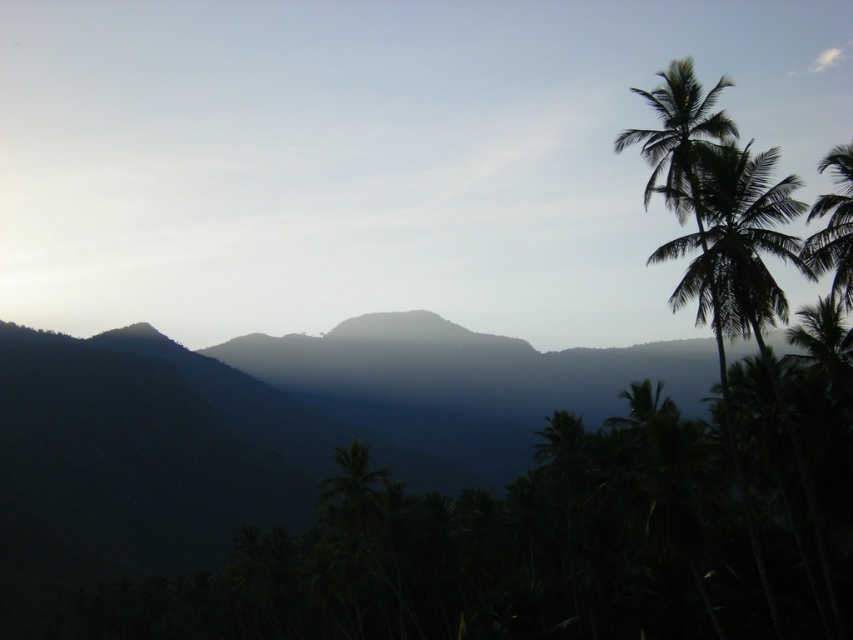
Question: Among these objects, which one is nearest to the camera?

Choices:
 (A) green leafy palm tree at upper right
 (B) green leafy palm tree at right

Answer: (B)

Question: Is green leafy palm tree at upper right to the left of green leafy palm tree at right from the viewer's perspective?

Choices:
 (A) no
 (B) yes

Answer: (B)

Question: Is green leafy palm tree at upper right positioned before green leafy palm tree at right?

Choices:
 (A) yes
 (B) no

Answer: (B)

Question: Which point is closer to the camera?

Choices:
 (A) (718, 83)
 (B) (815, 250)

Answer: (B)

Question: Which point is closer to the camera?

Choices:
 (A) green leafy palm tree at right
 (B) green leafy palm tree at upper right

Answer: (A)

Question: Does green leafy palm tree at upper right appear under green leafy palm tree at right?

Choices:
 (A) no
 (B) yes

Answer: (A)